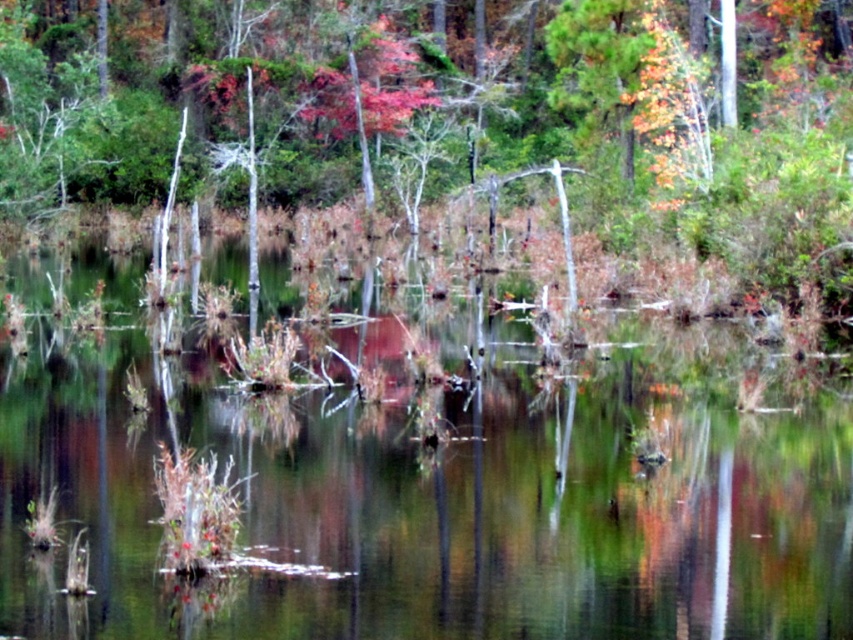
Question: Among these points, which one is farthest from the camera?

Choices:
 (A) (850, 588)
 (B) (595, 61)

Answer: (B)

Question: In this image, where is green reflective water at center located relative to smooth bark tree at center?

Choices:
 (A) right
 (B) left

Answer: (B)

Question: Can you confirm if green reflective water at center is thinner than smooth bark tree at center?

Choices:
 (A) yes
 (B) no

Answer: (A)

Question: Where is green reflective water at center located in relation to smooth bark tree at center in the image?

Choices:
 (A) above
 (B) below

Answer: (B)

Question: Which point is closer to the camera?

Choices:
 (A) (306, 163)
 (B) (59, 413)

Answer: (B)